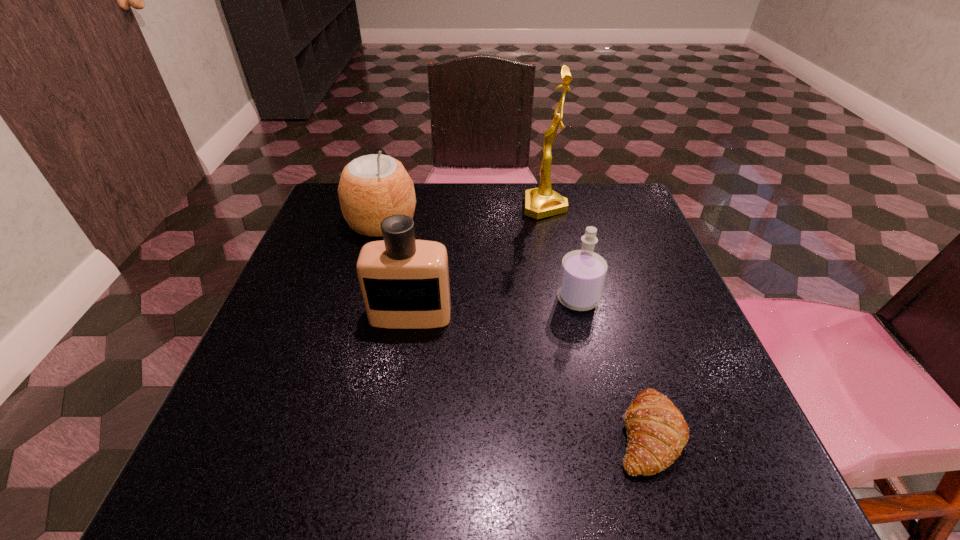
You are a GUI agent. You are given a task and a screenshot of the screen. Output one action in this format:
    pyautogui.click(x=<x>, y=<y>)
    Task: Click on the tallest object
    
    Given the screenshot: What is the action you would take?
    pyautogui.click(x=541, y=202)

At what (x,y) coordinates should I click in order to perform the action: click on coconut. Please return your answer as a coordinate pair (x, y). The image size is (960, 540). Looking at the image, I should click on (372, 187).

You are a GUI agent. You are given a task and a screenshot of the screen. Output one action in this format:
    pyautogui.click(x=<x>, y=<y>)
    Task: Click on the taller perfume
    
    Given the screenshot: What is the action you would take?
    pyautogui.click(x=404, y=282)

Find the location of a particular element. the right perfume is located at coordinates (583, 272).

Locate an element on the screen. the fourth tallest object is located at coordinates [583, 272].

This screenshot has width=960, height=540. Find the location of `crescent roll`. crescent roll is located at coordinates click(657, 433).

At what (x,y) coordinates should I click in order to perform the action: click on the nearest object. Please return your answer as a coordinate pair (x, y). The image size is (960, 540). Looking at the image, I should click on (657, 433).

Where is `free space located 0.300m on the front-facing side of the tallest object`? The image size is (960, 540). free space located 0.300m on the front-facing side of the tallest object is located at coordinates (407, 207).

You are a GUI agent. You are given a task and a screenshot of the screen. Output one action in this format:
    pyautogui.click(x=<x>, y=<y>)
    Task: Click on the vacant region located on the front-facing side of the tallest object
    The height and width of the screenshot is (540, 960).
    Given the screenshot: What is the action you would take?
    pyautogui.click(x=368, y=207)

Where is `vacant space located on the front-facing side of the tallest object`? This screenshot has width=960, height=540. vacant space located on the front-facing side of the tallest object is located at coordinates (465, 207).